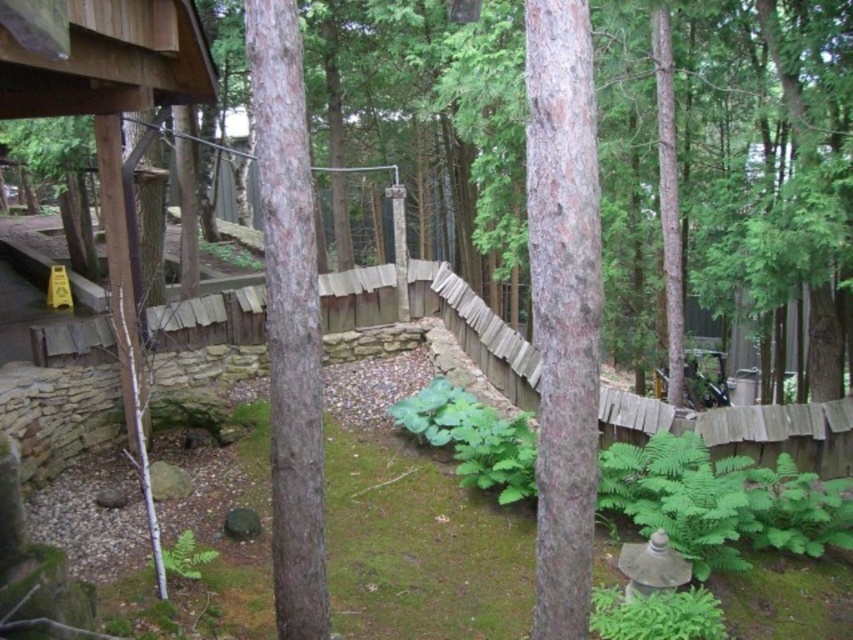
Between smooth brown tree trunk at center and brown rough bark tree at center, which one has more height?

brown rough bark tree at center is taller.

Can you confirm if smooth brown tree trunk at center is taller than brown rough bark tree at center?

In fact, smooth brown tree trunk at center may be shorter than brown rough bark tree at center.

Find the location of a particular element. smooth brown tree trunk at center is located at coordinates (563, 305).